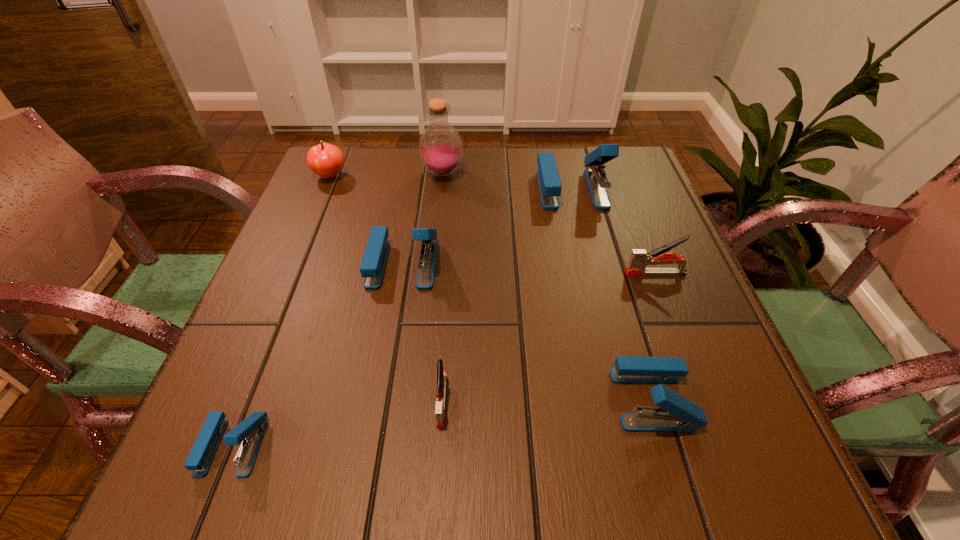
I want to click on free space between the farthest blue stapler and the third biggest blue stapler, so click(x=612, y=294).

The width and height of the screenshot is (960, 540). Identify the location of free space between the third biggest blue stapler and the right gray stapler. (654, 336).

The image size is (960, 540). I want to click on vacant area that lies between the farthest blue stapler and the fourth stapler from right to left, so click(x=507, y=295).

I want to click on free space between the biggest blue stapler and the tallest object, so click(507, 181).

The image size is (960, 540). Identify the location of empty space that is in between the second smallest blue stapler and the purple bottle. (548, 286).

The width and height of the screenshot is (960, 540). What are the coordinates of `vacant region between the second smallest blue stapler and the purple bottle` in the screenshot? It's located at (548, 286).

Choose which object is the third nearest neighbor to the third stapler from left to right. Please provide its 2D coordinates. Your answer should be formatted as a tuple, i.e. [(x, y)], where the tuple contains the x and y coordinates of a point satisfying the conditions above.

[(675, 413)]

Where is `object that ranks as the second closest to the tallest object`? Image resolution: width=960 pixels, height=540 pixels. object that ranks as the second closest to the tallest object is located at coordinates (326, 160).

What are the coordinates of `the fifth closest stapler to the apple` in the screenshot? It's located at (640, 258).

Locate which stapler is the third closest to the fourth stapler from right to left. Please provide its 2D coordinates. Your answer should be formatted as a tuple, i.e. [(x, y)], where the tuple contains the x and y coordinates of a point satisfying the conditions above.

[(675, 413)]